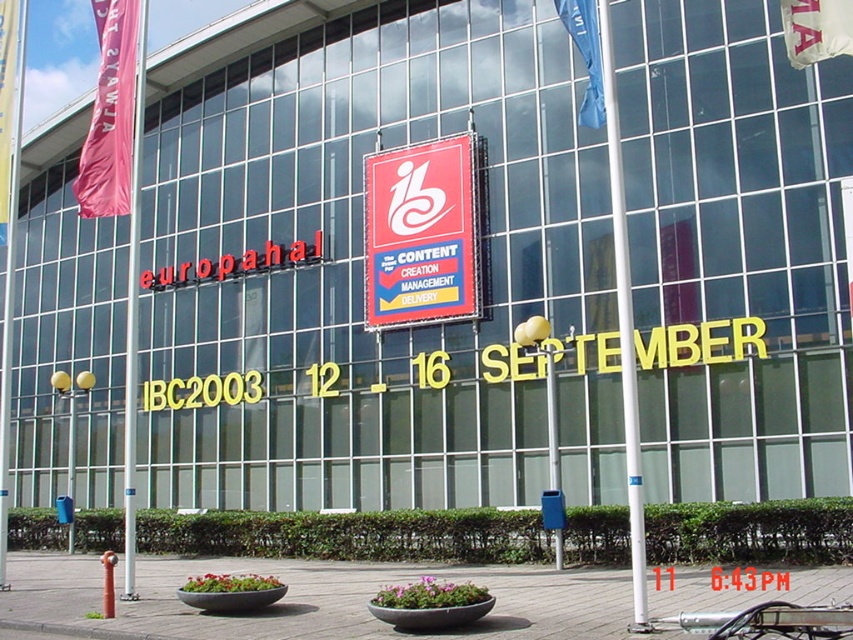
You are a visitor at the europahal event and want to find the red plastic sign at center. Which direction should you look relative to the blue fabric flag at upper right?

The red plastic sign at center is located below the blue fabric flag at upper right, so you should look downward from the blue fabric flag at upper right to find it.

You are standing in front of the modern glass building and want to take a photo of both the pink fabric flag at left and the blue fabric flag at upper right. Which flag should you adjust your camera angle to focus on first to ensure both are in the frame?

The pink fabric flag at left is closer to you than the blue fabric flag at upper right, so adjust your camera angle to focus on the pink fabric flag at left first to ensure both are in the frame.